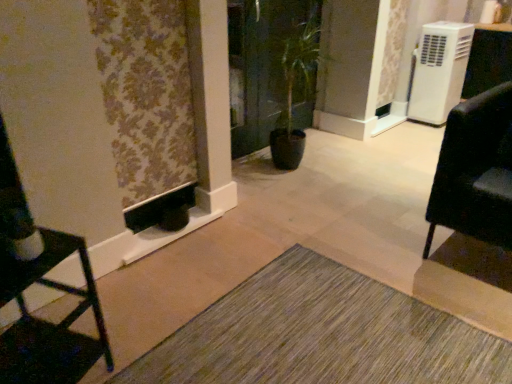
Question: From a real-world perspective, is green textured mat at lower center above or below matte black chair at left, the second furniture when ordered from right to left?

Choices:
 (A) below
 (B) above

Answer: (A)

Question: Looking at the image, does green textured mat at lower center seem bigger or smaller compared to matte black chair at left, acting as the first furniture starting from the left?

Choices:
 (A) big
 (B) small

Answer: (B)

Question: Which is nearer to the green textured mat at lower center?

Choices:
 (A) matte black chair at left, acting as the first furniture starting from the left
 (B) green glossy screen door at center
 (C) floral fabric curtain at left
 (D) black leather chair at right, which is the first furniture from back to front
 (E) white plastic air conditioner at upper right

Answer: (A)

Question: Estimate the real-world distances between objects in this image. Which object is farther from the white plastic air conditioner at upper right?

Choices:
 (A) black leather chair at right, the 1th furniture positioned from the right
 (B) floral fabric curtain at left
 (C) green textured mat at lower center
 (D) green glossy screen door at center
 (E) matte black chair at left, the second furniture when ordered from back to front

Answer: (E)